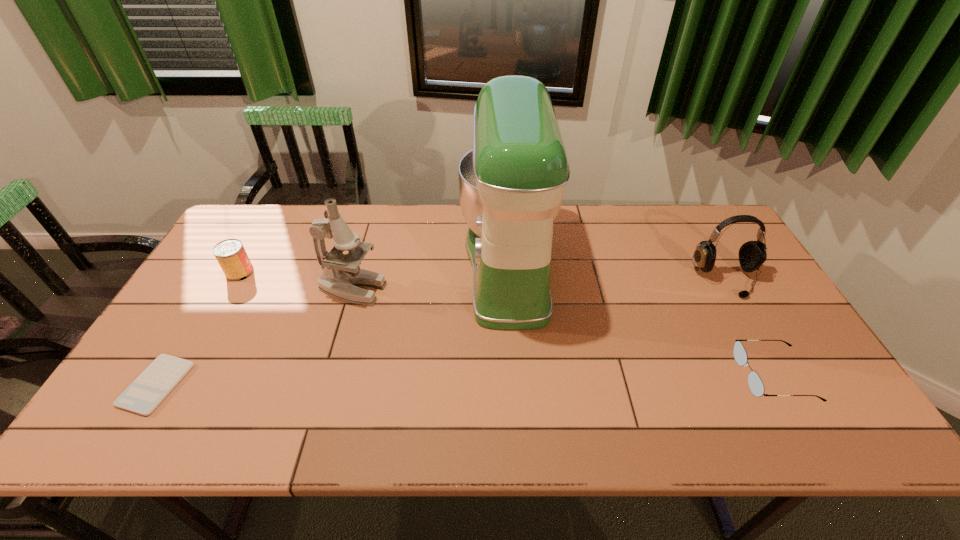
Where is `can that is positioned at the left edge`? can that is positioned at the left edge is located at coordinates (230, 254).

Where is `calculator present at the left edge`? calculator present at the left edge is located at coordinates (151, 387).

Find the location of `headset present at the right edge`. headset present at the right edge is located at coordinates (752, 254).

Locate an element on the screen. The height and width of the screenshot is (540, 960). spectacles at the right edge is located at coordinates (756, 386).

Find the location of a particular element. This screenshot has width=960, height=540. object that is at the near left corner is located at coordinates coord(151,387).

In the image, there is a desktop. Where is `vacant space at the far edge`? This screenshot has width=960, height=540. vacant space at the far edge is located at coordinates click(x=583, y=239).

This screenshot has height=540, width=960. Identify the location of free space at the near edge of the desktop. (500, 435).

Image resolution: width=960 pixels, height=540 pixels. In order to click on vacant space at the left edge of the desktop in this screenshot , I will do [222, 307].

Identify the location of vacant space at the right edge of the desktop. (797, 339).

Locate an element on the screen. The width and height of the screenshot is (960, 540). vacant space at the far right corner of the desktop is located at coordinates (689, 232).